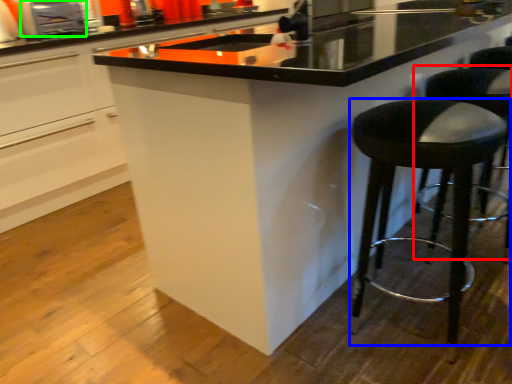
Question: Estimate the real-world distances between objects in this image. Which object is farther from bar stool (highlighted by a red box), stool (highlighted by a blue box) or appliance (highlighted by a green box)?

Choices:
 (A) stool
 (B) appliance

Answer: (B)